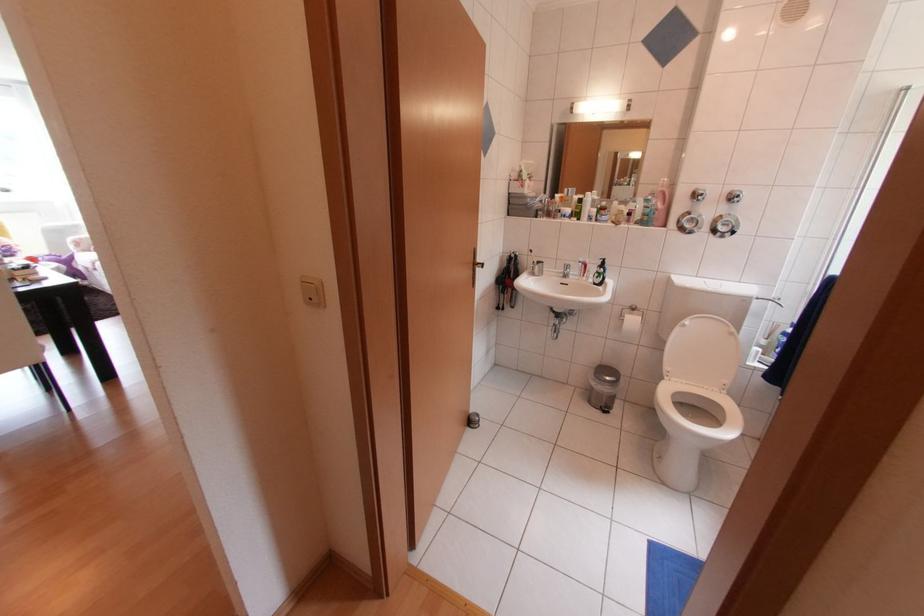
Describe the element at coordinates (600, 273) in the screenshot. I see `a black soap pump` at that location.